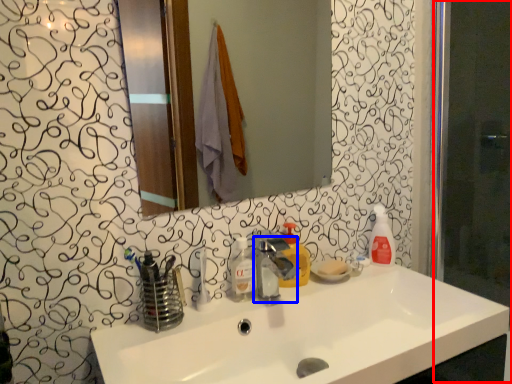
Question: Which object appears farthest to the camera in this image, screen door (highlighted by a red box) or tap (highlighted by a blue box)?

Choices:
 (A) screen door
 (B) tap

Answer: (A)